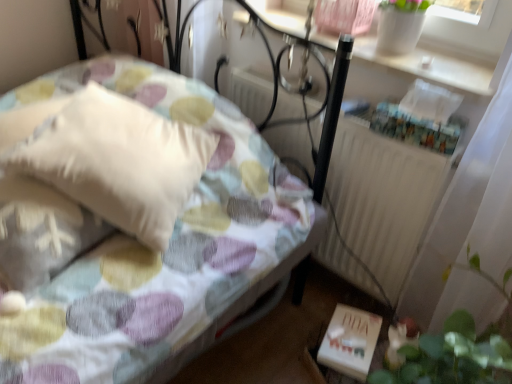
Question: From a real-world perspective, is white matte book at lower right on top of white textured radiator at center?

Choices:
 (A) yes
 (B) no

Answer: (B)

Question: Could you tell me if white matte book at lower right is facing white textured radiator at center?

Choices:
 (A) yes
 (B) no

Answer: (B)

Question: Does white matte book at lower right lie behind white textured radiator at center?

Choices:
 (A) no
 (B) yes

Answer: (B)

Question: Can you confirm if white matte book at lower right is positioned to the left of white textured radiator at center?

Choices:
 (A) yes
 (B) no

Answer: (B)

Question: Is white matte book at lower right beside white textured radiator at center?

Choices:
 (A) yes
 (B) no

Answer: (B)

Question: Is white textured radiator at center to the left or to the right of white soft pillow at left in the image?

Choices:
 (A) left
 (B) right

Answer: (B)

Question: From their relative heights in the image, would you say white textured radiator at center is taller or shorter than white soft pillow at left?

Choices:
 (A) tall
 (B) short

Answer: (A)

Question: Is white textured radiator at center wider or thinner than white soft pillow at left?

Choices:
 (A) thin
 (B) wide

Answer: (A)

Question: Based on their sizes in the image, would you say white textured radiator at center is bigger or smaller than white soft pillow at left?

Choices:
 (A) big
 (B) small

Answer: (B)

Question: Is white matte book at lower right wider or thinner than white ceramic vase at upper right?

Choices:
 (A) wide
 (B) thin

Answer: (B)

Question: Considering their positions, is white matte book at lower right located in front of or behind white ceramic vase at upper right?

Choices:
 (A) front
 (B) behind

Answer: (B)

Question: Is white matte book at lower right inside or outside of white ceramic vase at upper right?

Choices:
 (A) outside
 (B) inside

Answer: (A)

Question: Considering the positions of white matte book at lower right and white ceramic vase at upper right in the image, is white matte book at lower right taller or shorter than white ceramic vase at upper right?

Choices:
 (A) short
 (B) tall

Answer: (B)

Question: Is white textured radiator at center to the left or to the right of white matte book at lower right in the image?

Choices:
 (A) left
 (B) right

Answer: (A)

Question: Relative to white matte book at lower right, is white textured radiator at center in front or behind?

Choices:
 (A) front
 (B) behind

Answer: (A)